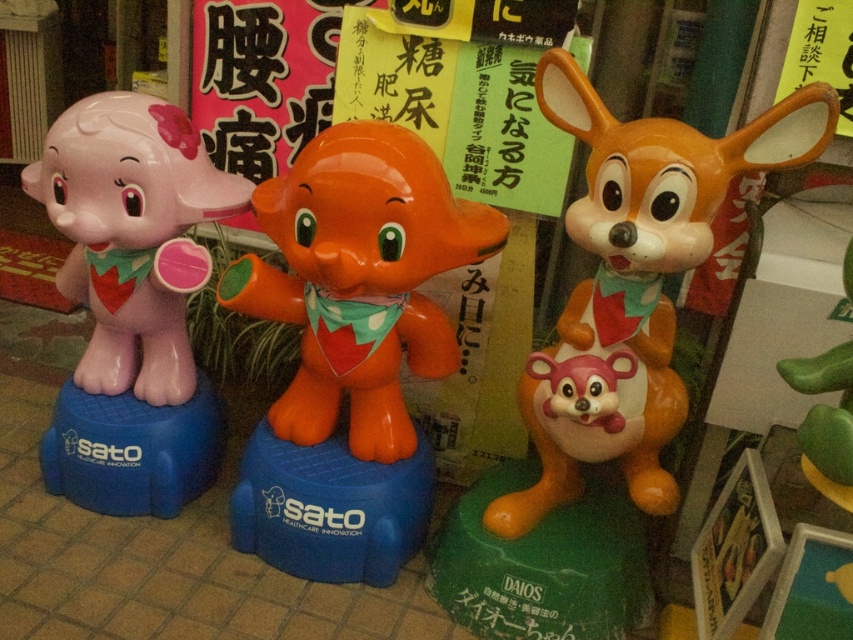
Can you confirm if matte orange plush toy at center is wider than glossy plastic elephant at center?

Incorrect, matte orange plush toy at center's width does not surpass glossy plastic elephant at center's.

Image resolution: width=853 pixels, height=640 pixels. Identify the location of matte orange plush toy at center. click(x=633, y=284).

Does matte orange plush toy at center have a greater height compared to matte plastic baby elephant at left?

Indeed, matte orange plush toy at center has a greater height compared to matte plastic baby elephant at left.

Find the location of a particular element. The width and height of the screenshot is (853, 640). matte orange plush toy at center is located at coordinates (633, 284).

Find the location of `matte orange plush toy at center`. matte orange plush toy at center is located at coordinates (633, 284).

Does glossy plastic elephant at center appear over matte plastic baby elephant at left?

Incorrect, glossy plastic elephant at center is not positioned above matte plastic baby elephant at left.

Describe the element at coordinates (360, 280) in the screenshot. I see `glossy plastic elephant at center` at that location.

The height and width of the screenshot is (640, 853). Describe the element at coordinates (360, 280) in the screenshot. I see `glossy plastic elephant at center` at that location.

I want to click on glossy plastic elephant at center, so click(x=360, y=280).